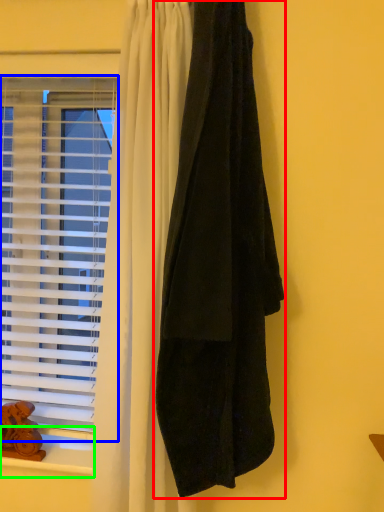
Question: Which object is the closest to the curtain (highlighted by a red box)? Choose among these: window (highlighted by a blue box) or window sill (highlighted by a green box).

Choices:
 (A) window
 (B) window sill

Answer: (A)